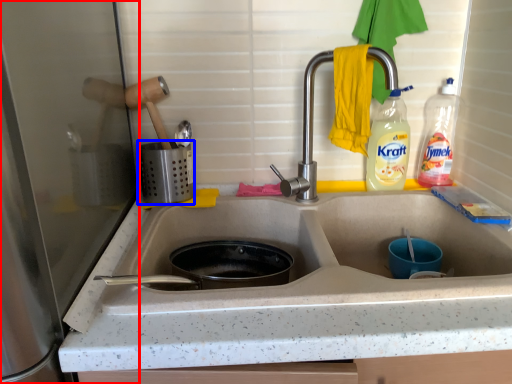
Question: Among these objects, which one is farthest to the camera, appliance (highlighted by a red box) or appliance (highlighted by a blue box)?

Choices:
 (A) appliance
 (B) appliance

Answer: (B)